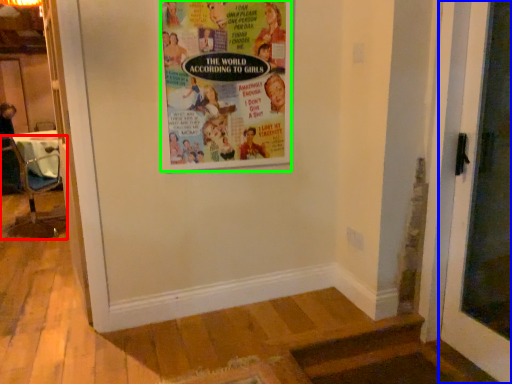
Question: Which object is the farthest from chair (highlighted by a red box)? Choose among these: door (highlighted by a blue box) or poster (highlighted by a green box).

Choices:
 (A) door
 (B) poster

Answer: (A)